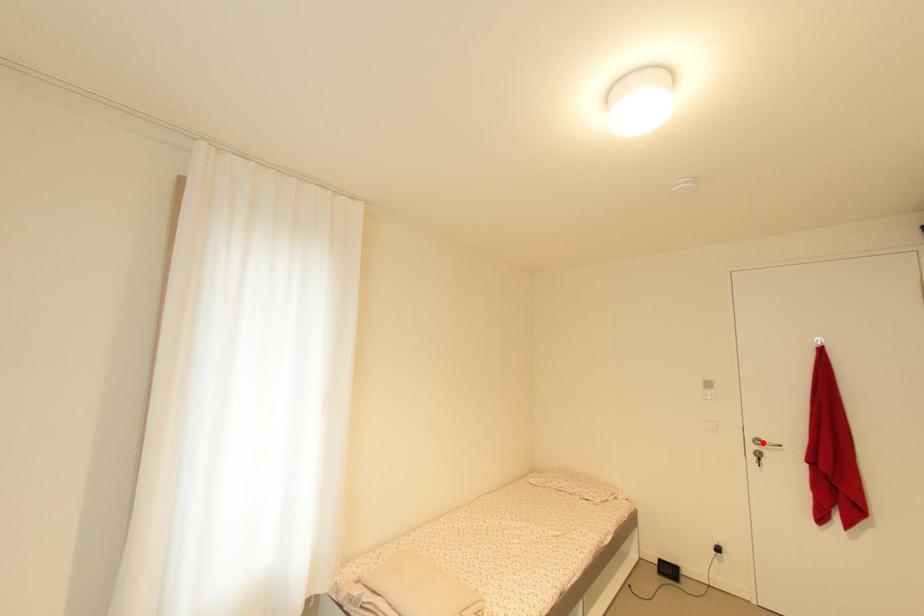
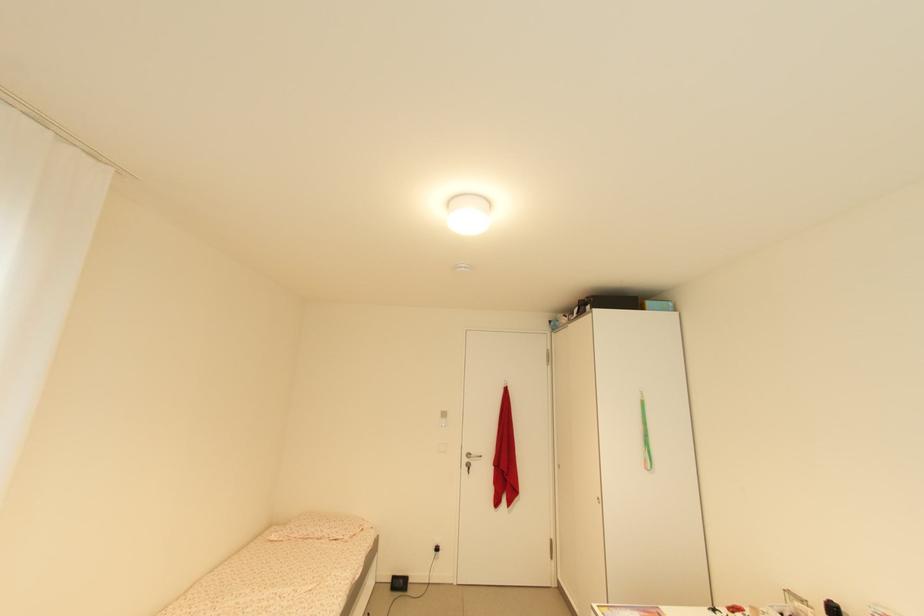
Locate, in the second image, the point that corresponds to the highlighted location in the first image.

(473, 456)